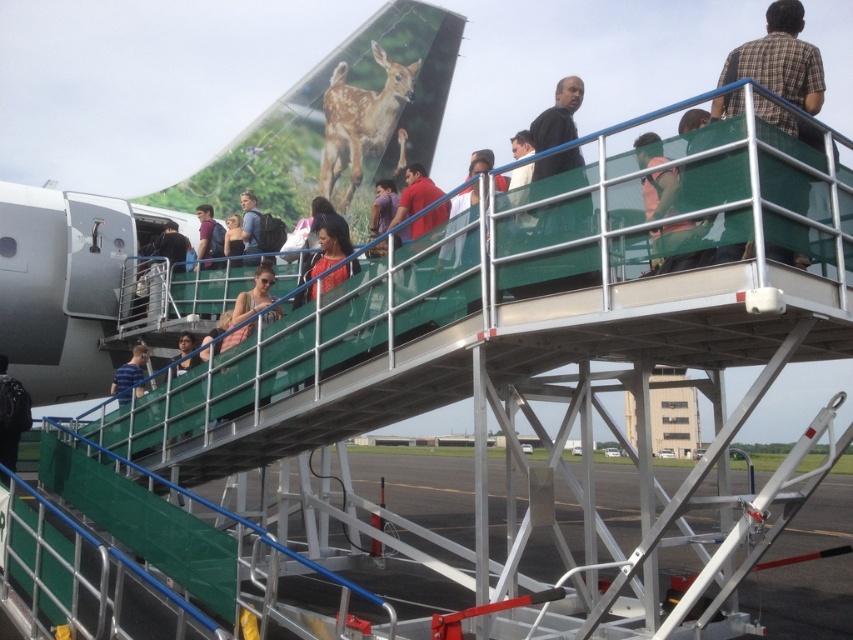
Question: Which object is positioned closest to the blue striped shirt at center?

Choices:
 (A) plaid shirt at upper right
 (B) dark blue shirt at center
 (C) black matte shirt at upper center

Answer: (B)

Question: Observing the image, what is the correct spatial positioning of orange fabric shirt at center in reference to matte pink dress at center?

Choices:
 (A) above
 (B) below

Answer: (A)

Question: Among these points, which one is nearest to the camera?

Choices:
 (A) (454, 205)
 (B) (268, 280)
 (C) (140, 355)

Answer: (A)

Question: Is metallic gray tarmac at lower center to the right of blue striped shirt at center from the viewer's perspective?

Choices:
 (A) yes
 (B) no

Answer: (A)

Question: Which point is farther to the camera?

Choices:
 (A) dark blue shirt at center
 (B) matte blue backpack at center
 (C) black matte shirt at upper center

Answer: (A)

Question: Can you confirm if metallic gray tarmac at lower center is thinner than black matte shirt at upper center?

Choices:
 (A) no
 (B) yes

Answer: (A)